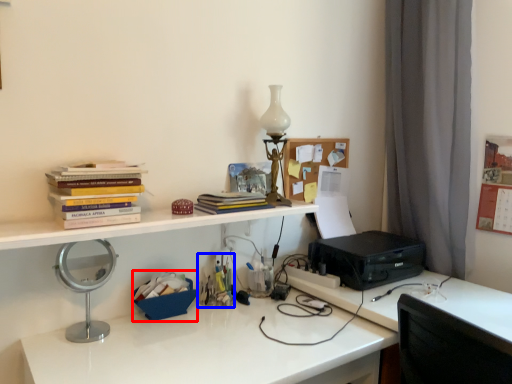
Question: Which object appears closest to the camera in this image, stationery (highlighted by a red box) or stationery (highlighted by a blue box)?

Choices:
 (A) stationery
 (B) stationery

Answer: (A)